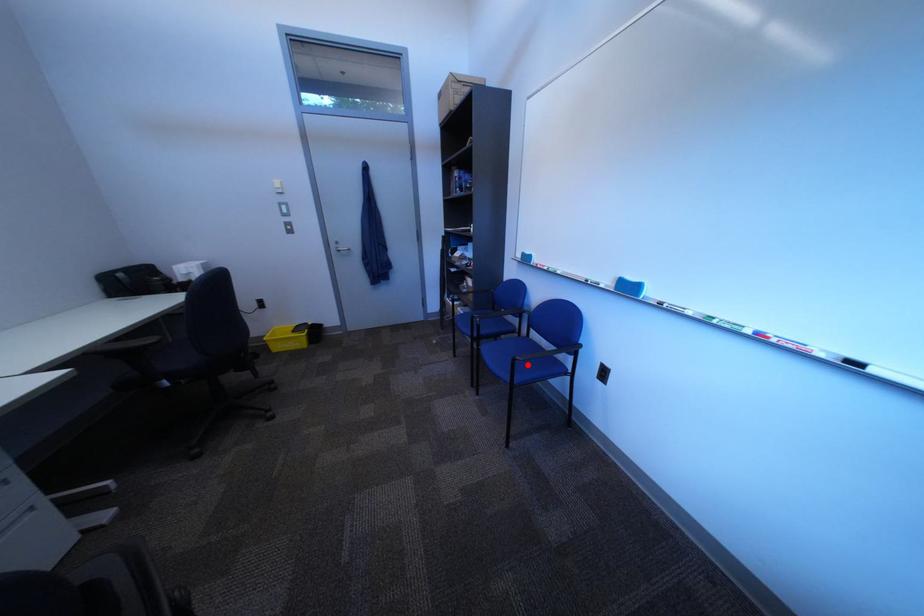
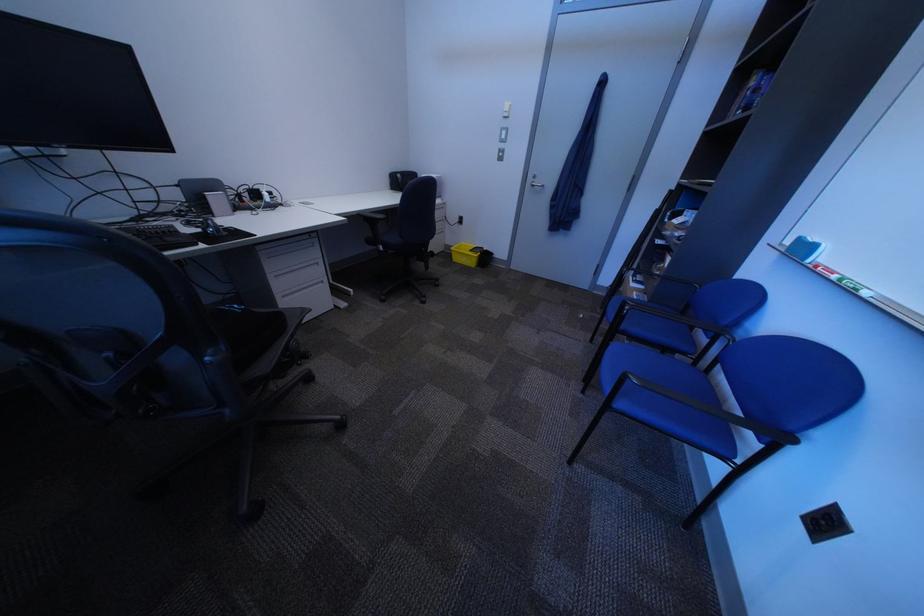
Question: I am providing you with two images of the same scene from different viewpoints. Image1 has a red point marked. In image2, the corresponding 3D location appears at what relative position? Reply with the corresponding letter.

Choices:
 (A) Closer
 (B) Farther

Answer: (A)